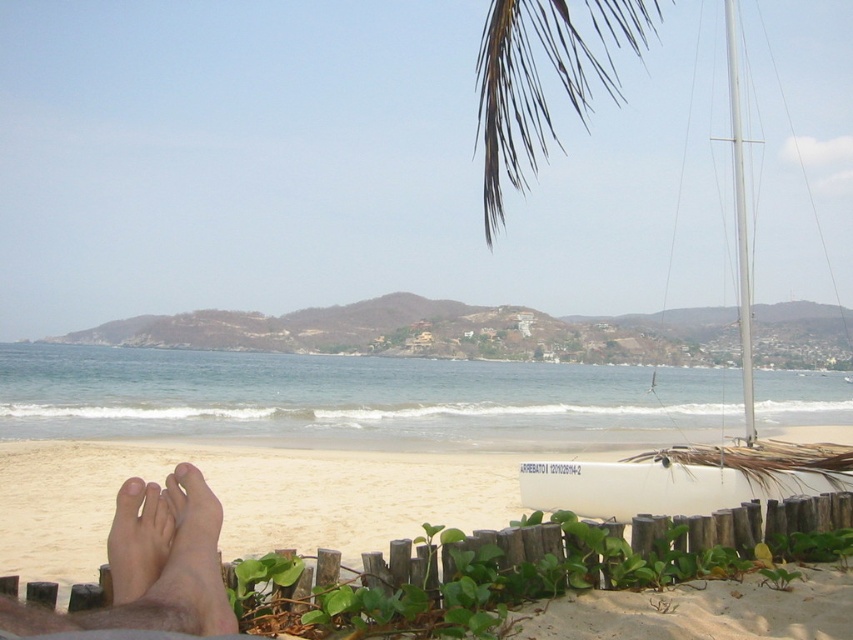
Who is positioned more to the right, white matte sailboat at right or pale skin at lower left?

Positioned to the right is white matte sailboat at right.

Can you confirm if white matte sailboat at right is smaller than pale skin at lower left?

No, white matte sailboat at right is not smaller than pale skin at lower left.

The height and width of the screenshot is (640, 853). In order to click on white matte sailboat at right in this screenshot , I will do `click(697, 445)`.

Is brown/dry palm fronds at upper center smaller than pale skin at lower left?

No.

Which is below, brown/dry palm fronds at upper center or pale skin at lower left?

pale skin at lower left is lower down.

Between point (517, 60) and point (131, 500), which one is positioned behind?

The point (517, 60) is more distant.

Where is `brown/dry palm fronds at upper center`? This screenshot has width=853, height=640. brown/dry palm fronds at upper center is located at coordinates (541, 81).

Can you confirm if white sand at lower center is bigger than skinny bare feet at lower left?

Yes, white sand at lower center is bigger than skinny bare feet at lower left.

What are the coordinates of `white sand at lower center` in the screenshot? It's located at (247, 497).

The height and width of the screenshot is (640, 853). Identify the location of white sand at lower center. (247, 497).